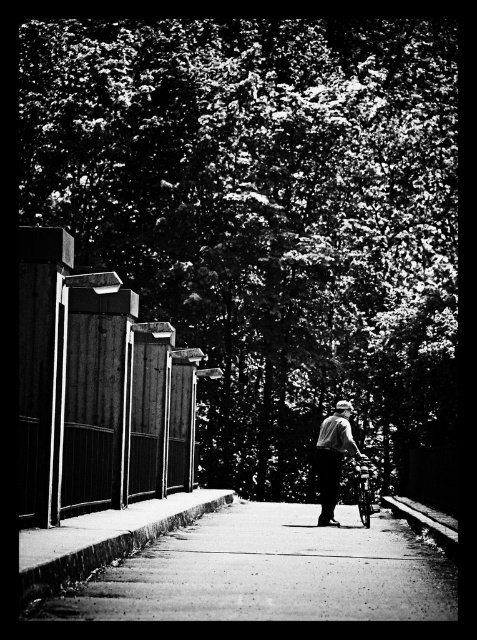
You are standing at the starting point of the pathway and want to reach the dark green foliage at upper center. Which direction should you move in relation to the wooden fence on the left side?

The dark green foliage at upper center is located at point (266, 214), so you should move forward along the pathway towards the upper center direction while keeping the wooden fence on your left side.

You are an observer looking at the scene. The dark green foliage at upper center and the smooth gray shirt at center are both visible. Which object occupies a wider area in the image?

The dark green foliage at upper center occupies a wider area in the image than the smooth gray shirt at center because its width is larger.

You are a photographer trying to capture a clear shot of the person walking down the pathway. The scene includes a dark green foliage at upper center and a smooth gray shirt at center. Which object is closer to the camera, making it harder to see the person?

The dark green foliage at upper center is closer to the camera than the smooth gray shirt at center, so it partially blocks the view of the person.